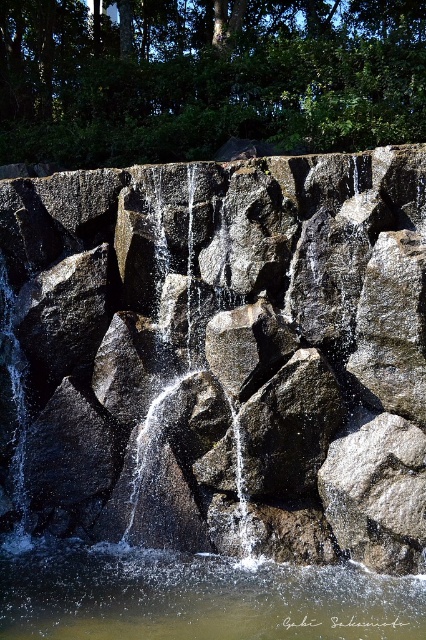
You are a hiker standing at the base of the rock formation looking up. You see two points marked on the rocks. Which point is closer to you, point (218, 360) or point (16, 586)?

Point (16, 586) is closer to you because it is less further to the viewer than point (218, 360).

From the picture: You are standing at the base of the rock formation and want to reach the clear water at center. Is the dark gray rock at center blocking your path to the water?

The clear water at center is behind the dark gray rock at center, so the dark gray rock at center is blocking your path to the water.